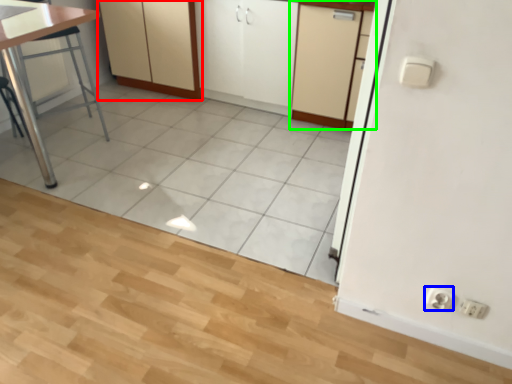
Question: Estimate the real-world distances between objects in this image. Which object is closer to cabinetry (highlighted by a red box), electric outlet (highlighted by a blue box) or cabinetry (highlighted by a green box)?

Choices:
 (A) electric outlet
 (B) cabinetry

Answer: (B)